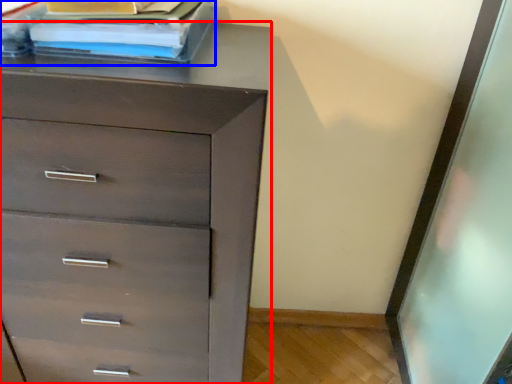
Question: Which point is further to the camera, chest of drawers (highlighted by a red box) or book (highlighted by a blue box)?

Choices:
 (A) chest of drawers
 (B) book

Answer: (B)